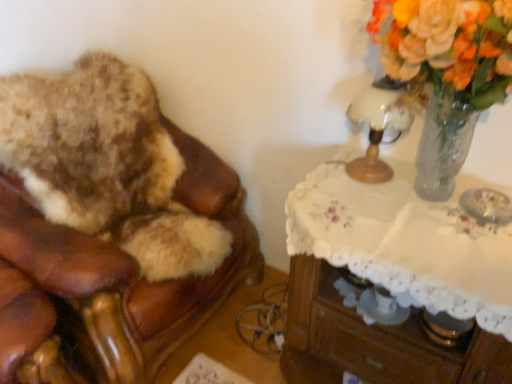
Question: Based on their sizes in the image, would you say translucent glass vase at upper right is bigger or smaller than white glass table lamp at upper right?

Choices:
 (A) big
 (B) small

Answer: (A)

Question: Is point (436, 64) positioned closer to the camera than point (371, 157)?

Choices:
 (A) farther
 (B) closer

Answer: (B)

Question: Which object is the closest to the white glass table lamp at upper right?

Choices:
 (A) translucent glass vase at upper right
 (B) white lace-covered table at upper right
 (C) brown leather chair at left

Answer: (A)

Question: Based on their relative distances, which object is nearer to the white glass table lamp at upper right?

Choices:
 (A) translucent glass vase at upper right
 (B) white lace-covered table at upper right
 (C) brown leather chair at left

Answer: (A)